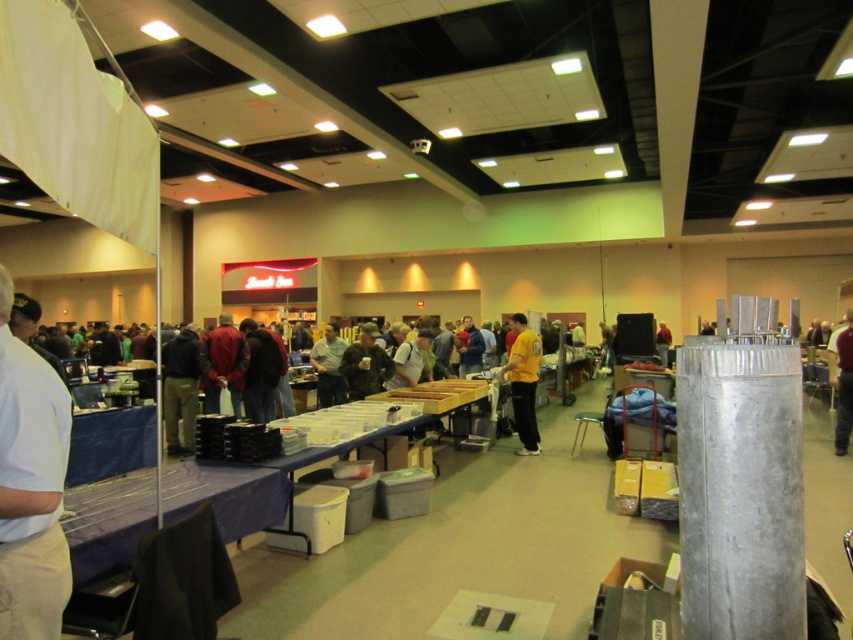
Question: Is white cotton shirt at left in front of yellow shirt at center?

Choices:
 (A) no
 (B) yes

Answer: (B)

Question: Does yellow matte shirt at center have a lesser width compared to yellow shirt at center?

Choices:
 (A) no
 (B) yes

Answer: (B)

Question: Based on their relative distances, which object is nearer to the yellow shirt at center?

Choices:
 (A) white cotton shirt at left
 (B) yellow matte shirt at center

Answer: (B)

Question: Which point is farther from the camera taking this photo?

Choices:
 (A) (10, 289)
 (B) (529, 388)

Answer: (B)

Question: Does yellow matte shirt at center have a smaller size compared to yellow shirt at center?

Choices:
 (A) yes
 (B) no

Answer: (B)

Question: Among these points, which one is nearest to the camera?

Choices:
 (A) (851, 401)
 (B) (3, 536)
 (C) (515, 316)

Answer: (B)